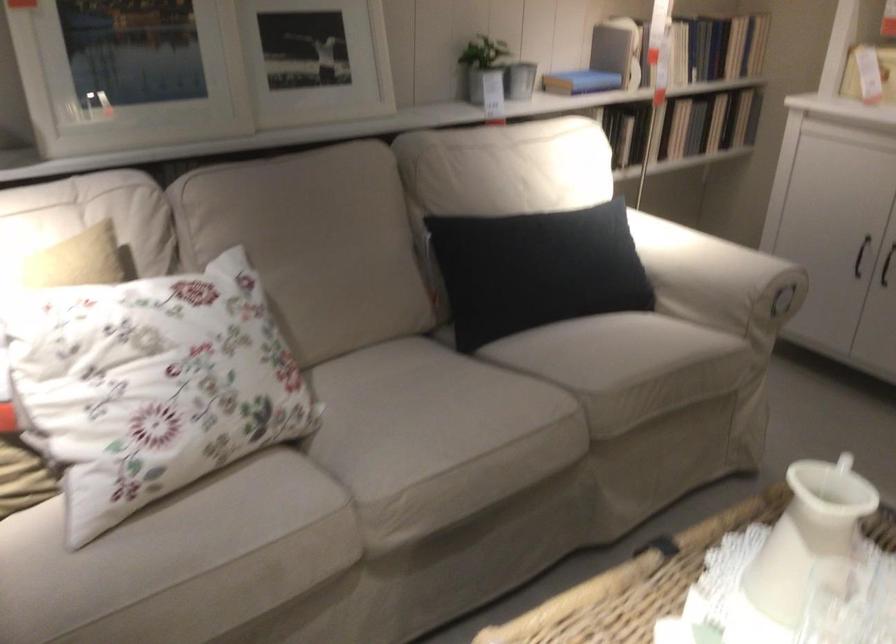
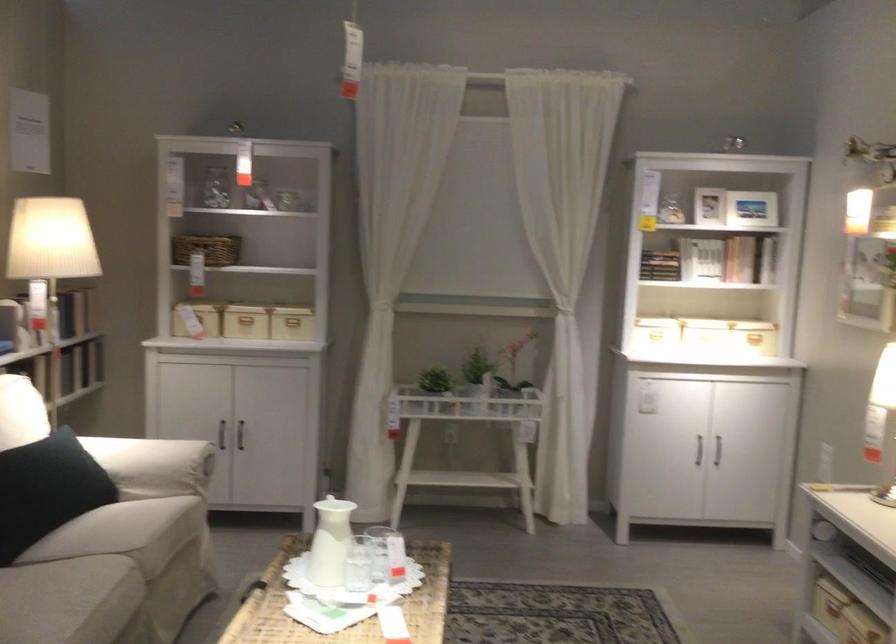
In the second image, find the point that corresponds to (536,270) in the first image.

(47, 489)